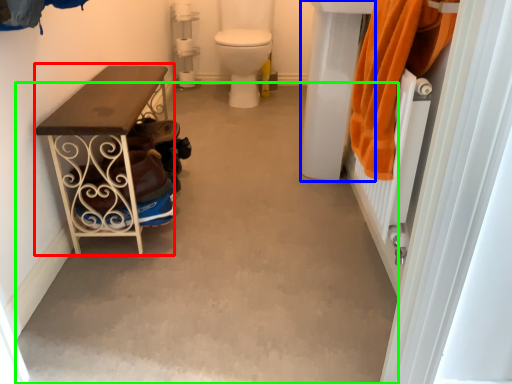
Question: Based on their relative distances, which object is farther from furniture (highlighted by a red box)? Choose from sink (highlighted by a blue box) and concrete (highlighted by a green box).

Choices:
 (A) sink
 (B) concrete

Answer: (A)